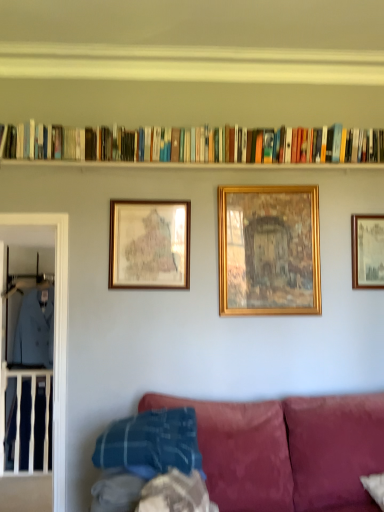
What do you see at coordinates (35, 331) in the screenshot? I see `light blue fabric at left, placed as the second clothing when sorted from left to right` at bounding box center [35, 331].

This screenshot has height=512, width=384. Describe the element at coordinates (197, 144) in the screenshot. I see `hardcover books at upper center` at that location.

The image size is (384, 512). What do you see at coordinates (269, 250) in the screenshot?
I see `gold/gilded picture frame at center, positioned as the 2th picture frame in right-to-left order` at bounding box center [269, 250].

What is the approximate height of gold-framed map at center-left, arranged as the third picture frame when viewed from the right?

gold-framed map at center-left, arranged as the third picture frame when viewed from the right, is 22.03 inches in height.

Where is `clear glass door at left`? The image size is (384, 512). clear glass door at left is located at coordinates (55, 339).

What do you see at coordinates (367, 251) in the screenshot? I see `gold-framed picture at upper center, the third picture frame positioned from the left` at bounding box center [367, 251].

Identify the location of light blue fabric at left, placed as the second clothing when sorted from left to right. (35, 331).

Based on the photo, considering the relative sizes of gold-framed picture at upper center, placed as the 1th picture frame when sorted from right to left, and light blue fabric at left, placed as the second clothing when sorted from left to right, in the image provided, is gold-framed picture at upper center, placed as the 1th picture frame when sorted from right to left, smaller than light blue fabric at left, placed as the second clothing when sorted from left to right,?

Yes.

Which is closer to the camera, (371, 280) or (51, 289)?

Point (371, 280) is closer to the camera than point (51, 289).

Which object is positioned more to the left, gold-framed picture at upper center, placed as the 1th picture frame when sorted from right to left, or light blue fabric at left, arranged as the 1th clothing when viewed from the right?

light blue fabric at left, arranged as the 1th clothing when viewed from the right.

From the image's perspective, relative to gold/gilded picture frame at center, positioned as the 2th picture frame in right-to-left order, is light blue fabric at left, placed as the second clothing when sorted from left to right, above or below?

Clearly, from the image's perspective, light blue fabric at left, placed as the second clothing when sorted from left to right, is below gold/gilded picture frame at center, positioned as the 2th picture frame in right-to-left order.

Considering the relative positions of light blue fabric at left, placed as the second clothing when sorted from left to right, and gold/gilded picture frame at center, positioned as the 2th picture frame in right-to-left order, in the image provided, is light blue fabric at left, placed as the second clothing when sorted from left to right, to the left of gold/gilded picture frame at center, positioned as the 2th picture frame in right-to-left order, from the viewer's perspective?

Correct, you'll find light blue fabric at left, placed as the second clothing when sorted from left to right, to the left of gold/gilded picture frame at center, positioned as the 2th picture frame in right-to-left order.

Looking at this image, from a real-world perspective, who is located lower, light blue fabric at left, placed as the second clothing when sorted from left to right, or gold/gilded picture frame at center, which is the 2th picture frame from left to right?

light blue fabric at left, placed as the second clothing when sorted from left to right, is physically lower.

From a real-world perspective, which object rests below the other?

light blue fabric at left, which is the 2th clothing in right-to-left order, from a real-world perspective.

In order to click on the 2nd clothing behind the gold/gilded picture frame at center, positioned as the 2th picture frame in right-to-left order in this screenshot , I will do `click(29, 388)`.

From the image's perspective, is gold/gilded picture frame at center, positioned as the 2th picture frame in right-to-left order, positioned above or below light blue fabric at left, acting as the first clothing starting from the left?

gold/gilded picture frame at center, positioned as the 2th picture frame in right-to-left order, is situated higher than light blue fabric at left, acting as the first clothing starting from the left, in the image.

From the picture: Considering the positions of objects gold-framed picture at upper center, placed as the 1th picture frame when sorted from right to left, and light blue fabric at left, acting as the first clothing starting from the left, in the image provided, who is more to the left, gold-framed picture at upper center, placed as the 1th picture frame when sorted from right to left, or light blue fabric at left, acting as the first clothing starting from the left,?

light blue fabric at left, acting as the first clothing starting from the left.

From the image's perspective, is gold-framed picture at upper center, the third picture frame positioned from the left, below light blue fabric at left, acting as the first clothing starting from the left?

No, from the image's perspective, gold-framed picture at upper center, the third picture frame positioned from the left, is not below light blue fabric at left, acting as the first clothing starting from the left.

Considering the relative sizes of gold-framed picture at upper center, placed as the 1th picture frame when sorted from right to left, and light blue fabric at left, which is the 2th clothing in right-to-left order, in the image provided, is gold-framed picture at upper center, placed as the 1th picture frame when sorted from right to left, shorter than light blue fabric at left, which is the 2th clothing in right-to-left order,?

Indeed, gold-framed picture at upper center, placed as the 1th picture frame when sorted from right to left, has a lesser height compared to light blue fabric at left, which is the 2th clothing in right-to-left order.

Which of these two, gold-framed picture at upper center, the third picture frame positioned from the left, or light blue fabric at left, which is the 2th clothing in right-to-left order, is bigger?

light blue fabric at left, which is the 2th clothing in right-to-left order, is bigger.

How many degrees apart are the facing directions of gold-framed map at center-left, positioned as the first picture frame in left-to-right order, and gold/gilded picture frame at center, positioned as the 2th picture frame in right-to-left order?

They differ by 1.62 degrees in their facing directions.

Does point (164, 241) come closer to viewer compared to point (303, 281)?

No, it is not.

Image resolution: width=384 pixels, height=512 pixels. Find the location of `picture frame that is on the left side of gold/gilded picture frame at center, positioned as the 2th picture frame in right-to-left order`. picture frame that is on the left side of gold/gilded picture frame at center, positioned as the 2th picture frame in right-to-left order is located at coordinates (149, 244).

Can you confirm if light blue fabric at left, acting as the first clothing starting from the left, is taller than gold/gilded picture frame at center, which is the 2th picture frame from left to right?

Correct, light blue fabric at left, acting as the first clothing starting from the left, is much taller as gold/gilded picture frame at center, which is the 2th picture frame from left to right.

Can you see light blue fabric at left, acting as the first clothing starting from the left, touching gold/gilded picture frame at center, which is the 2th picture frame from left to right?

light blue fabric at left, acting as the first clothing starting from the left, and gold/gilded picture frame at center, which is the 2th picture frame from left to right, are not in contact.

From the picture: From a real-world perspective, does light blue fabric at left, acting as the first clothing starting from the left, stand above gold/gilded picture frame at center, positioned as the 2th picture frame in right-to-left order?

No, from a real-world perspective, light blue fabric at left, acting as the first clothing starting from the left, is not on top of gold/gilded picture frame at center, positioned as the 2th picture frame in right-to-left order.

Is clear glass door at left oriented towards gold/gilded picture frame at center, which is the 2th picture frame from left to right?

No, clear glass door at left is not turned towards gold/gilded picture frame at center, which is the 2th picture frame from left to right.

Between clear glass door at left and gold/gilded picture frame at center, which is the 2th picture frame from left to right, which one has larger size?

clear glass door at left is bigger.

Which is farther from the camera, (56,422) or (270,233)?

The point (270,233) is behind.

From a real-world perspective, starting from the gold-framed picture at upper center, placed as the 1th picture frame when sorted from right to left, which clothing is the 1st one below it? Please provide its 2D coordinates.

[(35, 331)]

Find the location of `picture frame that is the 2nd one above the light blue fabric at left, arranged as the 1th clothing when viewed from the right (from a real-world perspective)`. picture frame that is the 2nd one above the light blue fabric at left, arranged as the 1th clothing when viewed from the right (from a real-world perspective) is located at coordinates (269, 250).

From the image, which object appears to be nearer to gold/gilded picture frame at center, positioned as the 2th picture frame in right-to-left order, light blue fabric at left, which is the 2th clothing in right-to-left order, or clear glass door at left?

Among the two, clear glass door at left is located nearer to gold/gilded picture frame at center, positioned as the 2th picture frame in right-to-left order.

Based on their spatial positions, is light blue fabric at left, which is the 2th clothing in right-to-left order, or light blue fabric at left, placed as the second clothing when sorted from left to right, closer to clear glass door at left?

Among the two, light blue fabric at left, which is the 2th clothing in right-to-left order, is located nearer to clear glass door at left.

Based on their spatial positions, is light blue fabric at left, placed as the second clothing when sorted from left to right, or clear glass door at left further from hardcover books at upper center?

light blue fabric at left, placed as the second clothing when sorted from left to right, lies further to hardcover books at upper center than the other object.

Looking at the image, which one is located closer to gold-framed map at center-left, arranged as the third picture frame when viewed from the right, light blue fabric at left, arranged as the 1th clothing when viewed from the right, or gold/gilded picture frame at center, which is the 2th picture frame from left to right?

Among the two, gold/gilded picture frame at center, which is the 2th picture frame from left to right, is located nearer to gold-framed map at center-left, arranged as the third picture frame when viewed from the right.

From the image, which object appears to be nearer to light blue fabric at left, acting as the first clothing starting from the left, gold/gilded picture frame at center, which is the 2th picture frame from left to right, or light blue fabric at left, arranged as the 1th clothing when viewed from the right?

Based on the image, light blue fabric at left, arranged as the 1th clothing when viewed from the right, appears to be nearer to light blue fabric at left, acting as the first clothing starting from the left.

Estimate the real-world distances between objects in this image. Which object is further from hardcover books at upper center, gold/gilded picture frame at center, which is the 2th picture frame from left to right, or light blue fabric at left, placed as the second clothing when sorted from left to right?

Among the two, light blue fabric at left, placed as the second clothing when sorted from left to right, is located further to hardcover books at upper center.

Considering their positions, is gold-framed picture at upper center, the third picture frame positioned from the left, positioned closer to clear glass door at left than gold/gilded picture frame at center, which is the 2th picture frame from left to right?

gold/gilded picture frame at center, which is the 2th picture frame from left to right.

In the scene shown: Estimate the real-world distances between objects in this image. Which object is closer to hardcover books at upper center, gold-framed picture at upper center, placed as the 1th picture frame when sorted from right to left, or light blue fabric at left, arranged as the 1th clothing when viewed from the right?

gold-framed picture at upper center, placed as the 1th picture frame when sorted from right to left, lies closer to hardcover books at upper center than the other object.

I want to click on picture frame between hardcover books at upper center and gold-framed picture at upper center, placed as the 1th picture frame when sorted from right to left, in the horizontal direction, so click(269, 250).

I want to click on picture frame between gold-framed map at center-left, arranged as the third picture frame when viewed from the right, and gold-framed picture at upper center, the third picture frame positioned from the left, so click(269, 250).

Image resolution: width=384 pixels, height=512 pixels. Identify the location of clothing between light blue fabric at left, which is the 2th clothing in right-to-left order, and gold-framed picture at upper center, the third picture frame positioned from the left, from left to right. pos(35,331).

The height and width of the screenshot is (512, 384). In order to click on book located between clear glass door at left and gold/gilded picture frame at center, positioned as the 2th picture frame in right-to-left order, in the left-right direction in this screenshot , I will do `click(197, 144)`.